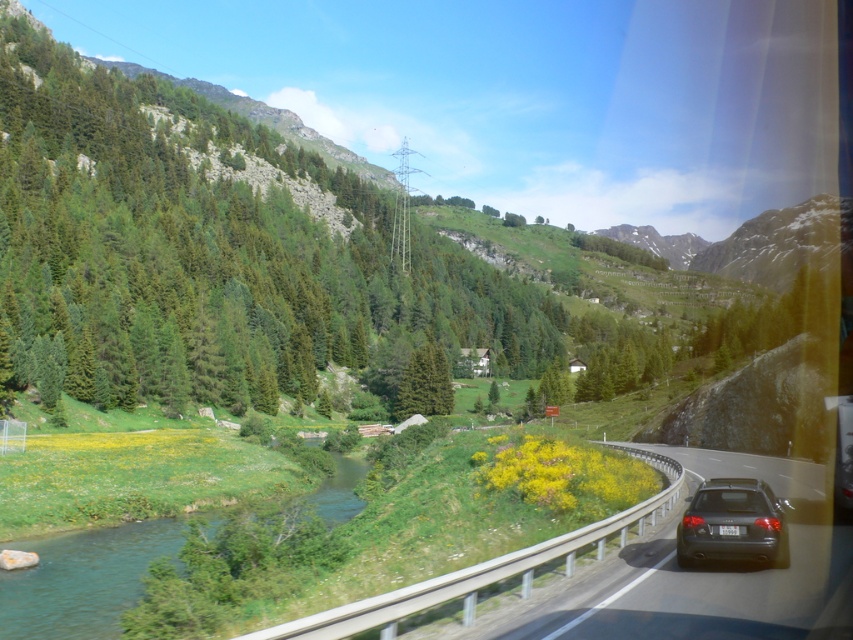
You are a passenger in a car driving along the road in the image. You notice two points marked on the scene. The first point is at coordinates point [780,524] and the second is at point [404,374]. Which point is closer to you as you look out the windshield?

Point [780,524] is closer to the viewer than point [404,374].

You are a passenger in the dark gray metallic car at lower right and want to know where the black asphalt highway at center is located relative to your current position. Can you tell me?

The black asphalt highway at center is positioned under the dark gray metallic car at lower right, meaning it is directly beneath the car as it travels along the road.